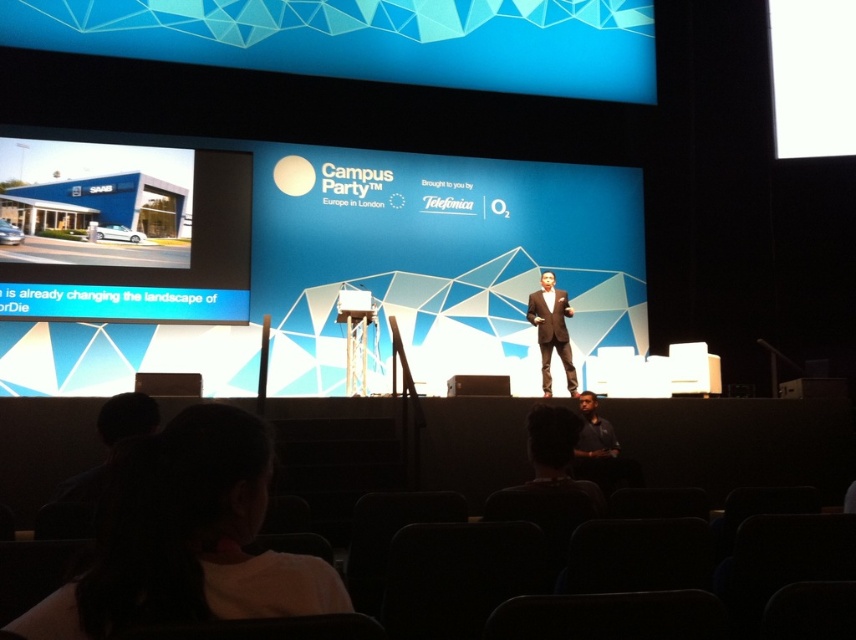
Describe the element at coordinates (187, 538) in the screenshot. The image size is (856, 640). I see `white t-shirt at lower left` at that location.

Is white t-shirt at lower left smaller than white plastic projector at center?

Actually, white t-shirt at lower left might be larger than white plastic projector at center.

Who is more forward, (191, 516) or (366, 301)?

Point (191, 516)

This screenshot has width=856, height=640. Identify the location of white t-shirt at lower left. (187, 538).

Can you confirm if white t-shirt at lower left is positioned above brown suit at center?

Indeed, white t-shirt at lower left is positioned over brown suit at center.

Is white t-shirt at lower left positioned before brown suit at center?

Yes.

Measure the distance between point (200, 605) and camera.

The distance of point (200, 605) from camera is 1.17 meters.

Locate an element on the screen. This screenshot has height=640, width=856. white t-shirt at lower left is located at coordinates (187, 538).

Who is more forward, (623, 84) or (538, 291)?

Positioned in front is point (538, 291).

What are the coordinates of `blue geometric pattern at upper center` in the screenshot? It's located at (367, 38).